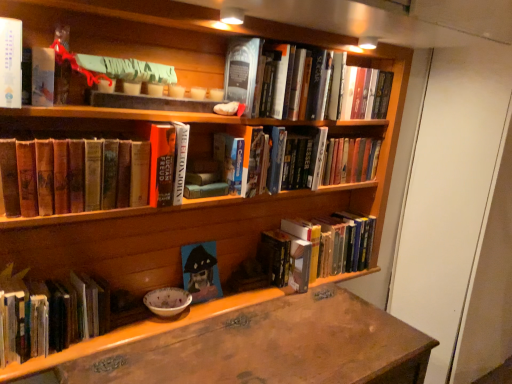
Question: From a real-world perspective, is wooden desk at lower center positioned under hardcover book at upper center, the 2th book from the right, based on gravity?

Choices:
 (A) no
 (B) yes

Answer: (B)

Question: From the image's perspective, is wooden desk at lower center on top of hardcover book at upper center, marked as the 6th book in a left-to-right arrangement?

Choices:
 (A) yes
 (B) no

Answer: (B)

Question: Could you tell me if wooden desk at lower center is turned towards hardcover book at upper center, the 2th book from the right?

Choices:
 (A) yes
 (B) no

Answer: (B)

Question: Can you confirm if wooden desk at lower center is smaller than hardcover book at upper center, marked as the 6th book in a left-to-right arrangement?

Choices:
 (A) no
 (B) yes

Answer: (A)

Question: Is wooden desk at lower center surrounding hardcover book at upper center, marked as the 6th book in a left-to-right arrangement?

Choices:
 (A) yes
 (B) no

Answer: (B)

Question: From the image's perspective, is hardcover book at upper center, marked as the 6th book in a left-to-right arrangement, positioned above or below brown leather book at lower left, which is counted as the second book, starting from the left?

Choices:
 (A) above
 (B) below

Answer: (A)

Question: Would you say hardcover book at upper center, the 2th book from the right, is inside or outside brown leather book at lower left, the 6th book from the right?

Choices:
 (A) inside
 (B) outside

Answer: (B)

Question: Based on their sizes in the image, would you say hardcover book at upper center, marked as the 6th book in a left-to-right arrangement, is bigger or smaller than brown leather book at lower left, which is counted as the second book, starting from the left?

Choices:
 (A) small
 (B) big

Answer: (B)

Question: In terms of height, does hardcover book at upper center, marked as the 6th book in a left-to-right arrangement, look taller or shorter compared to brown leather book at lower left, the 6th book from the right?

Choices:
 (A) short
 (B) tall

Answer: (B)

Question: Considering the positions of point (60, 301) and point (48, 182), is point (60, 301) closer or farther from the camera than point (48, 182)?

Choices:
 (A) closer
 (B) farther

Answer: (B)

Question: From a real-world perspective, is hardcover book at lower left, the first book when ordered from left to right, above or below brown leather book at lower left, the 6th book from the right?

Choices:
 (A) above
 (B) below

Answer: (B)

Question: From the image's perspective, is hardcover book at lower left, which is the 7th book from right to left, above or below brown leather book at lower left, the 6th book from the right?

Choices:
 (A) below
 (B) above

Answer: (A)

Question: Is hardcover book at lower left, the first book when ordered from left to right, spatially inside brown leather book at lower left, which is counted as the second book, starting from the left, or outside of it?

Choices:
 (A) outside
 (B) inside

Answer: (A)

Question: Relative to hardcover book at upper center, the 2th book from the right, is brown leather book at lower left, which is counted as the second book, starting from the left, in front or behind?

Choices:
 (A) behind
 (B) front

Answer: (B)

Question: From the image's perspective, is brown leather book at lower left, the 6th book from the right, above or below hardcover book at upper center, marked as the 6th book in a left-to-right arrangement?

Choices:
 (A) above
 (B) below

Answer: (B)